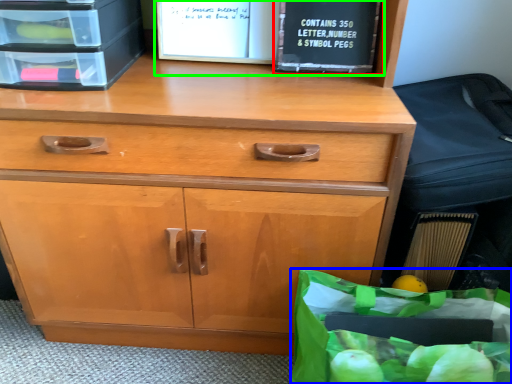
Question: Estimate the real-world distances between objects in this image. Which object is farther from paperback book (highlighted by a red box), grocery bag (highlighted by a blue box) or book (highlighted by a green box)?

Choices:
 (A) grocery bag
 (B) book

Answer: (A)